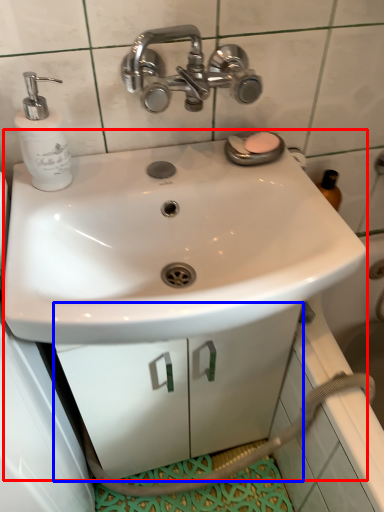
Question: Which point is closer to the camera, sink (highlighted by a red box) or drawer (highlighted by a blue box)?

Choices:
 (A) sink
 (B) drawer

Answer: (A)